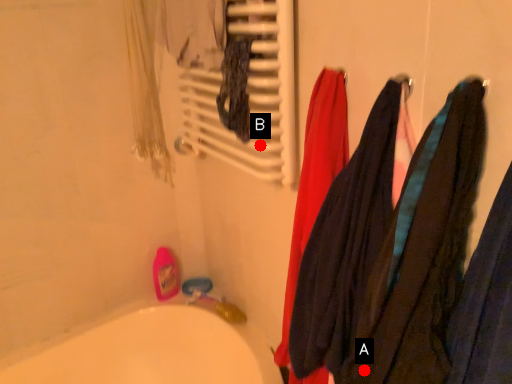
Question: Two points are circled on the image, labeled by A and B beside each circle. Which point is farther from the camera taking this photo?

Choices:
 (A) A is further
 (B) B is further

Answer: (B)